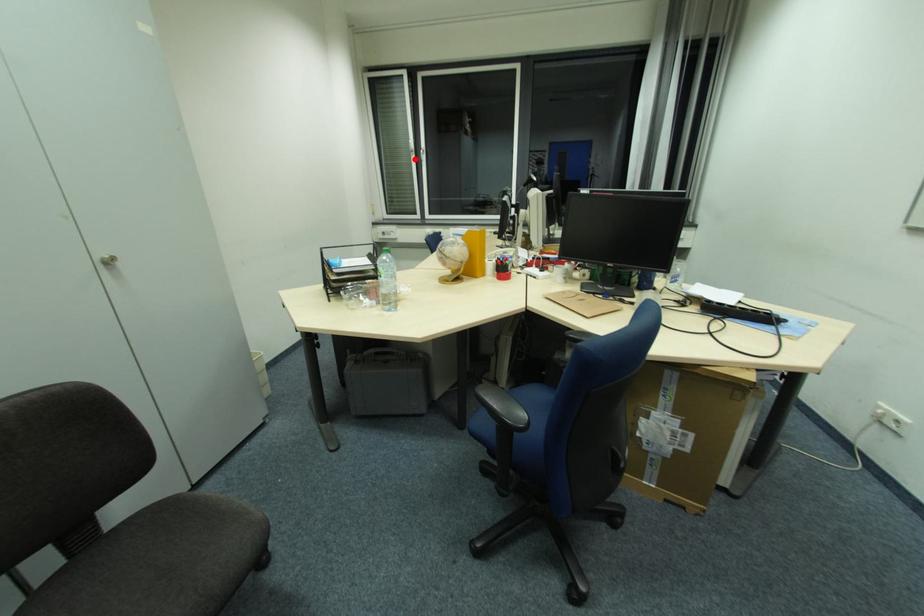
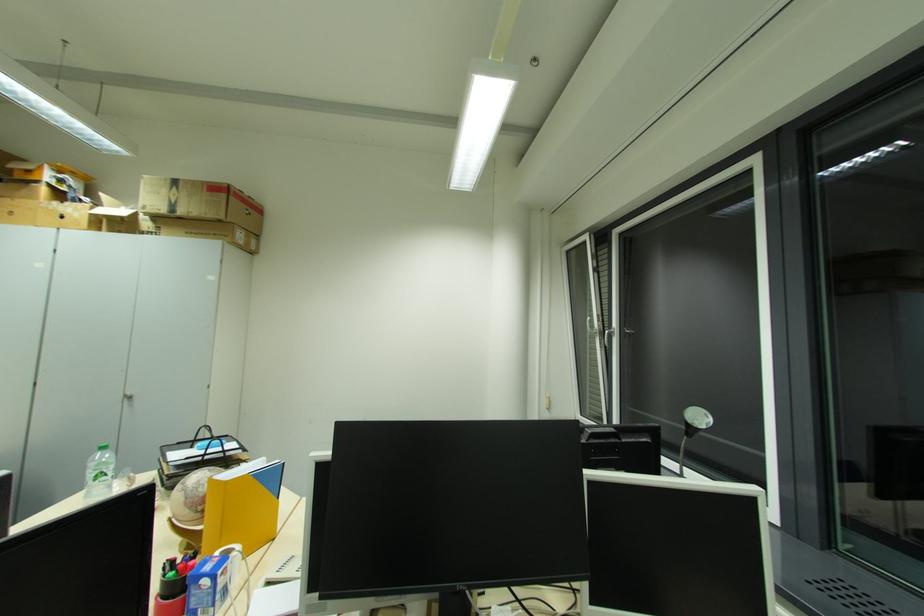
Locate, in the second image, the point that corresponds to the highlighted location in the first image.

(600, 342)